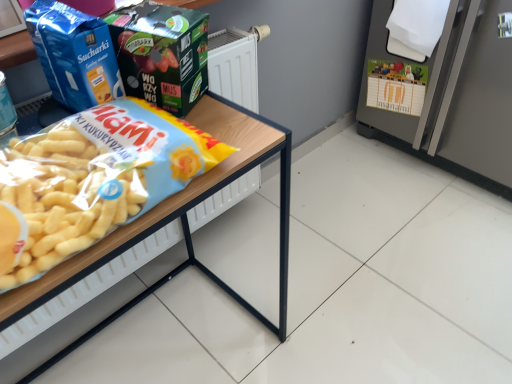
Question: From a real-world perspective, is matte green box at upper center, the second product in the left-to-right sequence, positioned above or below satin silver refrigerator at right?

Choices:
 (A) above
 (B) below

Answer: (A)

Question: Is matte green box at upper center, the second product in the left-to-right sequence, to the left or to the right of satin silver refrigerator at right in the image?

Choices:
 (A) right
 (B) left

Answer: (B)

Question: Which of these objects is positioned farthest from the satin silver refrigerator at right?

Choices:
 (A) blue matte bag at upper left, positioned as the second product in right-to-left order
 (B) wooden table at left
 (C) matte green box at upper center, which is the first product from right to left

Answer: (A)

Question: Considering the real-world distances, which object is closest to the matte green box at upper center, which is the first product from right to left?

Choices:
 (A) wooden table at left
 (B) blue matte bag at upper left, placed as the first product when sorted from left to right
 (C) satin silver refrigerator at right

Answer: (B)